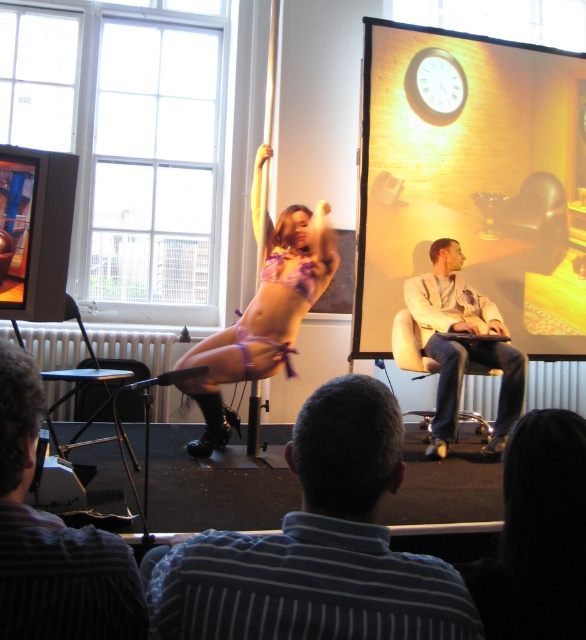
Does metallic blue chair at center have a greater height compared to leather chair at center?

Indeed, metallic blue chair at center has a greater height compared to leather chair at center.

Locate an element on the screen. This screenshot has width=586, height=640. metallic blue chair at center is located at coordinates (87, 385).

Where is `metallic blue chair at center`? metallic blue chair at center is located at coordinates (87, 385).

Does light beige leather jacket at center have a larger size compared to leather chair at center?

Yes.

Can you confirm if light beige leather jacket at center is positioned to the right of leather chair at center?

Correct, you'll find light beige leather jacket at center to the right of leather chair at center.

I want to click on light beige leather jacket at center, so click(x=461, y=344).

This screenshot has width=586, height=640. Find the location of `light beige leather jacket at center`. light beige leather jacket at center is located at coordinates (461, 344).

Between matte gold clock at upper center and leather chair at center, which one has more height?

matte gold clock at upper center is taller.

Is matte gold clock at upper center above leather chair at center?

Yes, matte gold clock at upper center is above leather chair at center.

I want to click on matte gold clock at upper center, so click(x=472, y=179).